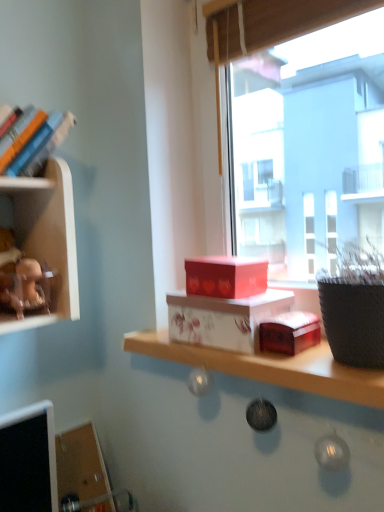
Question: Considering the relative sizes of white glossy box at center and transparent glass window at center in the image provided, is white glossy box at center shorter than transparent glass window at center?

Choices:
 (A) no
 (B) yes

Answer: (B)

Question: Is white glossy box at center not near transparent glass window at center?

Choices:
 (A) yes
 (B) no

Answer: (B)

Question: Considering the relative sizes of white glossy box at center and transparent glass window at center in the image provided, is white glossy box at center taller than transparent glass window at center?

Choices:
 (A) yes
 (B) no

Answer: (B)

Question: Considering the relative sizes of white glossy box at center and transparent glass window at center in the image provided, is white glossy box at center bigger than transparent glass window at center?

Choices:
 (A) no
 (B) yes

Answer: (A)

Question: Does white glossy box at center lie behind transparent glass window at center?

Choices:
 (A) yes
 (B) no

Answer: (B)

Question: Is point (18, 163) closer or farther from the camera than point (3, 249)?

Choices:
 (A) closer
 (B) farther

Answer: (A)

Question: In terms of height, does hardcover books at left look taller or shorter compared to matte brown figurine at upper left?

Choices:
 (A) short
 (B) tall

Answer: (B)

Question: Would you say hardcover books at left is inside or outside matte brown figurine at upper left?

Choices:
 (A) inside
 (B) outside

Answer: (B)

Question: From a real-world perspective, is hardcover books at left above or below matte brown figurine at upper left?

Choices:
 (A) below
 (B) above

Answer: (B)

Question: Would you say hardcover books at left is inside or outside transparent glass window at center?

Choices:
 (A) inside
 (B) outside

Answer: (B)

Question: Based on their positions, is hardcover books at left located to the left or right of transparent glass window at center?

Choices:
 (A) left
 (B) right

Answer: (A)

Question: Considering their positions, is hardcover books at left located in front of or behind transparent glass window at center?

Choices:
 (A) front
 (B) behind

Answer: (B)

Question: From a real-world perspective, is hardcover books at left above or below transparent glass window at center?

Choices:
 (A) below
 (B) above

Answer: (B)

Question: From the image's perspective, is white glossy box at center positioned above or below transparent glass window at center?

Choices:
 (A) below
 (B) above

Answer: (A)

Question: Considering the positions of white glossy box at center and transparent glass window at center in the image, is white glossy box at center wider or thinner than transparent glass window at center?

Choices:
 (A) thin
 (B) wide

Answer: (B)